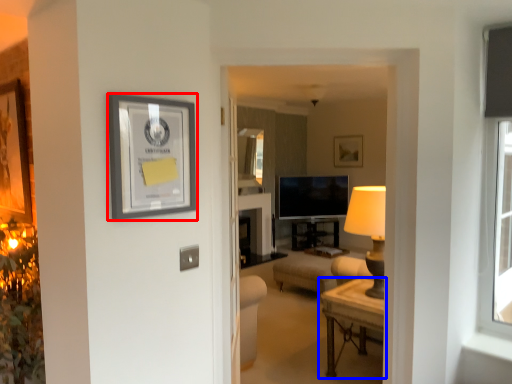
Question: Which object is further to the camera taking this photo, picture frame (highlighted by a red box) or table (highlighted by a blue box)?

Choices:
 (A) picture frame
 (B) table

Answer: (B)